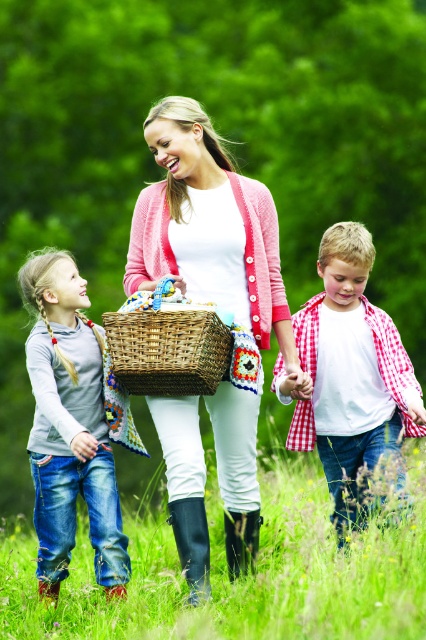
Is pink knitted cardigan at center below woven wicker basket at center?

No, pink knitted cardigan at center is not below woven wicker basket at center.

Is pink knitted cardigan at center bigger than woven wicker basket at center?

Yes.

Does point (253, 202) come in front of point (161, 364)?

No, it is not.

Find the location of `pink knitted cardigan at center`. pink knitted cardigan at center is located at coordinates (209, 228).

Between denim jeans at left and woven wicker basket at center, which one appears on the right side from the viewer's perspective?

Positioned to the right is woven wicker basket at center.

Between denim jeans at left and woven wicker basket at center, which one appears on the left side from the viewer's perspective?

denim jeans at left is more to the left.

You are a GUI agent. You are given a task and a screenshot of the screen. Output one action in this format:
    pyautogui.click(x=<x>, y=<y>)
    Task: Click on the denim jeans at left
    The height and width of the screenshot is (640, 426).
    Given the screenshot: What is the action you would take?
    pyautogui.click(x=72, y=426)

Is denim jeans at left to the right of white checkered shirt at center from the viewer's perspective?

In fact, denim jeans at left is to the left of white checkered shirt at center.

Can you confirm if denim jeans at left is positioned to the left of white checkered shirt at center?

Yes, denim jeans at left is to the left of white checkered shirt at center.

Is point (37, 364) positioned behind point (319, 301)?

No, it is in front of (319, 301).

Where is `denim jeans at left`? denim jeans at left is located at coordinates (72, 426).